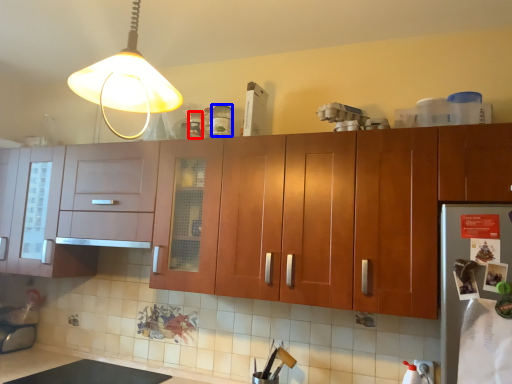
Question: Which point is further to the camera, bottle (highlighted by a red box) or bottle (highlighted by a blue box)?

Choices:
 (A) bottle
 (B) bottle

Answer: (A)